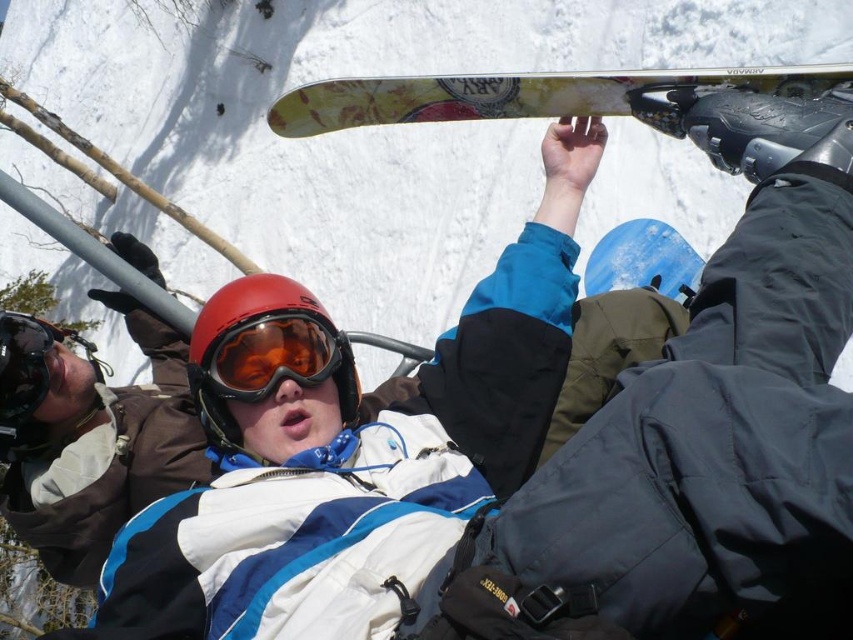
You are a photographer trying to capture both the white matte jacket at center and the matte orange ski goggles at center in a single frame. Based on their size in the image, which object would you need to focus on more closely to ensure it appears prominently in the photo?

The white matte jacket at center occupies less space than the matte orange ski goggles at center, so you should focus on the matte orange ski goggles at center to ensure it appears prominently in the photo since it takes up more space in the frame.

You are standing at the base of the ski resort and see two points in the snowy scene. Which point, point (430, 467) or point (315, 353), is closer to you?

Point (430, 467) is closer to the viewer than point (315, 353).